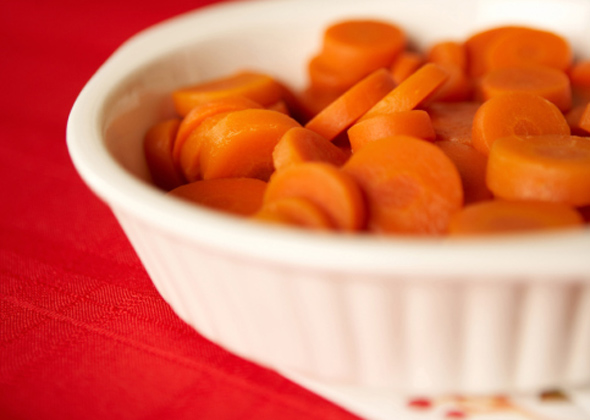
Where is `tablecloth`? Image resolution: width=590 pixels, height=420 pixels. tablecloth is located at coordinates (131, 362), (51, 200).